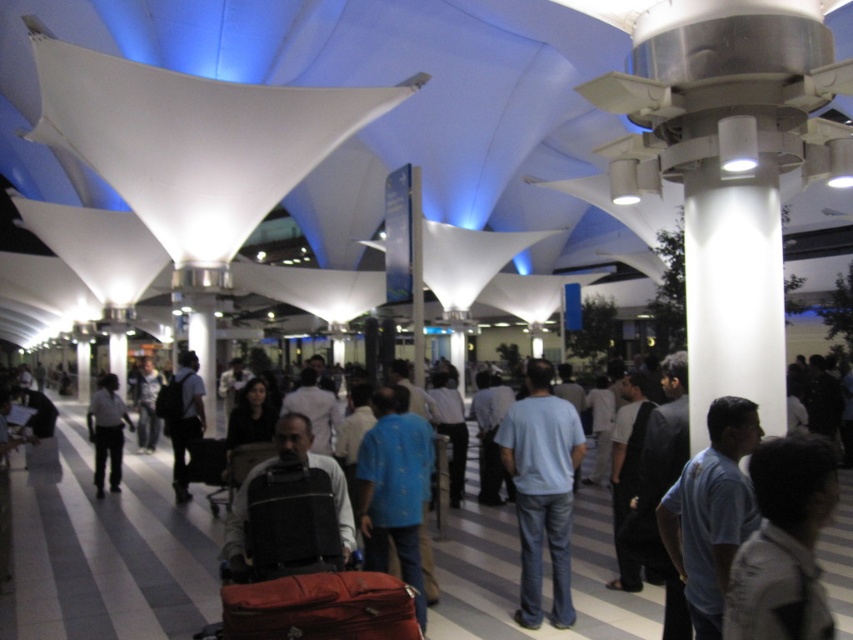
At what (x,y) coordinates should I click in order to perform the action: click on light gray fabric shirt at center. Please return your answer as a coordinate pair (x, y). The image size is (853, 640). Looking at the image, I should click on pos(784,545).

Between light gray fabric shirt at center and light blue cotton shirt at center, which one appears on the left side from the viewer's perspective?

From the viewer's perspective, light blue cotton shirt at center appears more on the left side.

Measure the distance between light gray fabric shirt at center and camera.

light gray fabric shirt at center and camera are 11.66 feet apart from each other.

Where is `light gray fabric shirt at center`? light gray fabric shirt at center is located at coordinates (784, 545).

Is light gray fabric shirt at center thinner than dark gray fabric bag at center?

Indeed, light gray fabric shirt at center has a lesser width compared to dark gray fabric bag at center.

Which is behind, point (750, 588) or point (286, 486)?

Point (286, 486)

Looking at this image, who is more forward, [785,484] or [247,541]?

Point [785,484] is in front.

This screenshot has width=853, height=640. What are the coordinates of `light gray fabric shirt at center` in the screenshot? It's located at (784, 545).

Does dark gray fabric bag at center have a smaller size compared to black leather suitcase at center?

Actually, dark gray fabric bag at center might be larger than black leather suitcase at center.

Can you confirm if dark gray fabric bag at center is shorter than black leather suitcase at center?

No, dark gray fabric bag at center is not shorter than black leather suitcase at center.

At what (x,y) coordinates should I click in order to perform the action: click on dark gray fabric bag at center. Please return your answer as a coordinate pair (x, y). The width and height of the screenshot is (853, 640). Looking at the image, I should click on (289, 513).